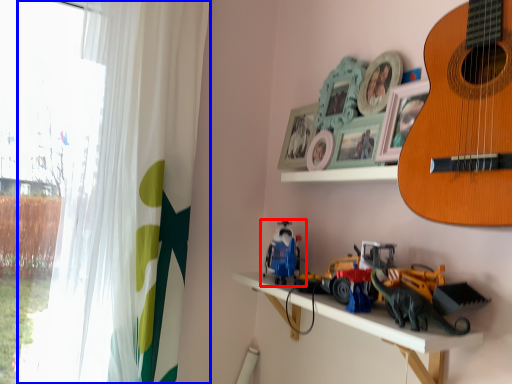
Question: Among these objects, which one is farthest to the camera, toy (highlighted by a red box) or curtain (highlighted by a blue box)?

Choices:
 (A) toy
 (B) curtain

Answer: (B)